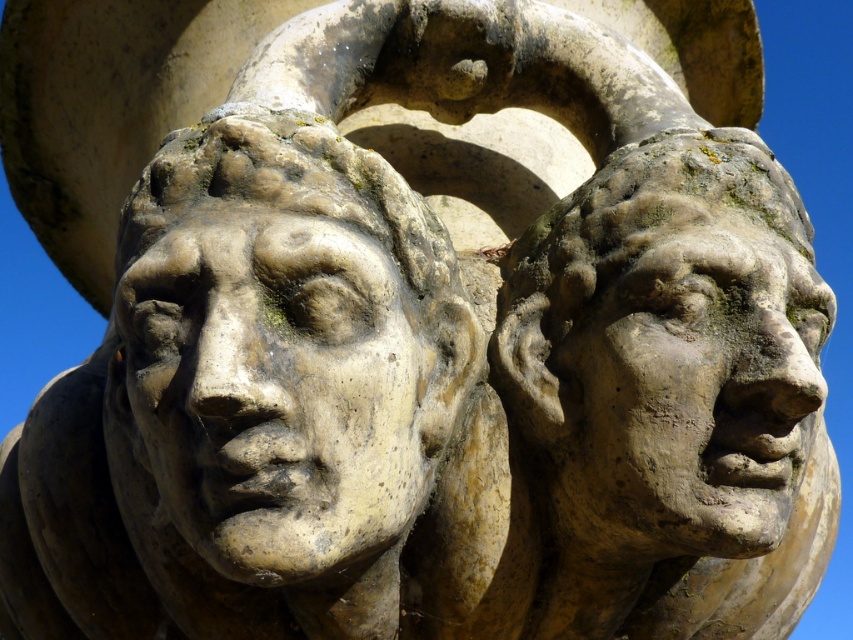
Is stone textured face at center wider than matte stone face at right?

Yes, stone textured face at center is wider than matte stone face at right.

Does stone textured face at center have a smaller size compared to matte stone face at right?

No.

Between point (219, 492) and point (741, 458), which one is positioned in front?

Point (219, 492) is more forward.

Image resolution: width=853 pixels, height=640 pixels. I want to click on stone textured face at center, so click(288, 342).